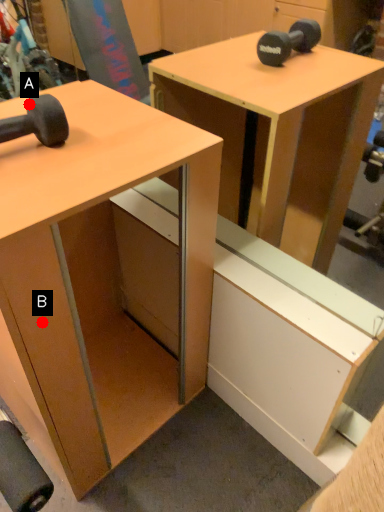
Question: Two points are circled on the image, labeled by A and B beside each circle. Which point is closer to the camera?

Choices:
 (A) A is closer
 (B) B is closer

Answer: (B)